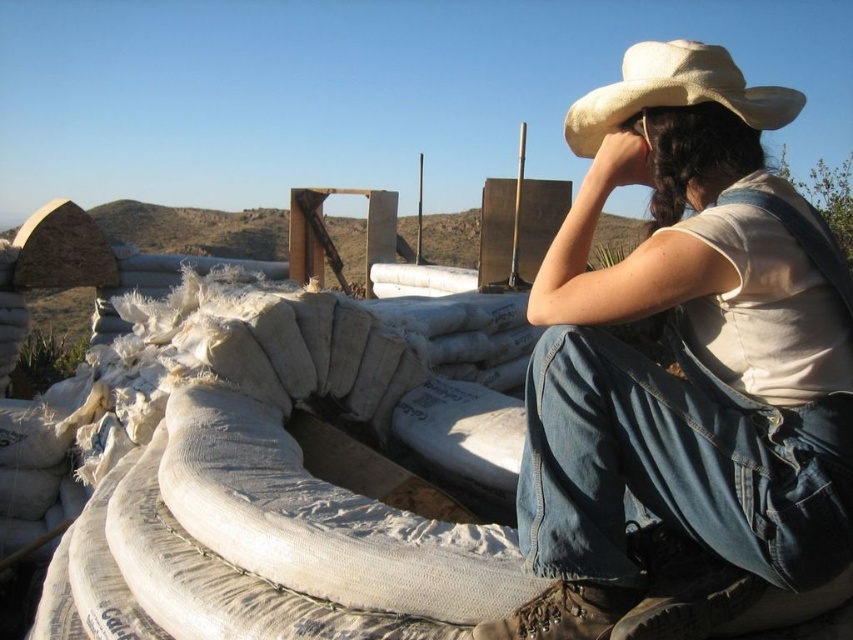
Question: Which point is closer to the camera?

Choices:
 (A) (679, 52)
 (B) (585, 392)

Answer: (B)

Question: Does white denim overalls at upper right have a larger size compared to beige fabric cowboy hat at upper right?

Choices:
 (A) no
 (B) yes

Answer: (B)

Question: Considering the relative positions of white denim overalls at upper right and beige fabric cowboy hat at upper right in the image provided, where is white denim overalls at upper right located with respect to beige fabric cowboy hat at upper right?

Choices:
 (A) left
 (B) right

Answer: (A)

Question: Can you confirm if white denim overalls at upper right is smaller than beige fabric cowboy hat at upper right?

Choices:
 (A) yes
 (B) no

Answer: (B)

Question: Among these points, which one is nearest to the camera?

Choices:
 (A) (729, 80)
 (B) (650, 508)

Answer: (B)